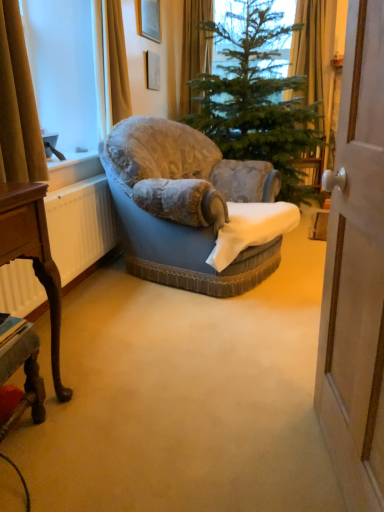
Question: Based on their positions, is wooden polished desk at lower left, which is the 1th desk from top to bottom, located to the left or right of white matte radiator at left?

Choices:
 (A) right
 (B) left

Answer: (A)

Question: From a real-world perspective, is wooden polished desk at lower left, which is the 1th desk from top to bottom, above or below white matte radiator at left?

Choices:
 (A) above
 (B) below

Answer: (A)

Question: Estimate the real-world distances between objects in this image. Which object is closer to the wooden desk at lower left, which is the first desk from bottom to top?

Choices:
 (A) green textured christmas tree at center
 (B) velvet blue armchair at center
 (C) white matte radiator at left
 (D) yellow fabric curtain at upper center, the first curtain in the back-to-front sequence
 (E) matte gold picture frame at upper center

Answer: (C)

Question: Which object is positioned closest to the matte gold picture frame at upper center?

Choices:
 (A) brown fabric curtain at left, arranged as the first curtain when viewed from the left
 (B) wooden desk at lower left, which is the second desk from top to bottom
 (C) velvet blue armchair at center
 (D) wooden polished desk at lower left, acting as the 2th desk starting from the bottom
 (E) white matte radiator at left

Answer: (C)